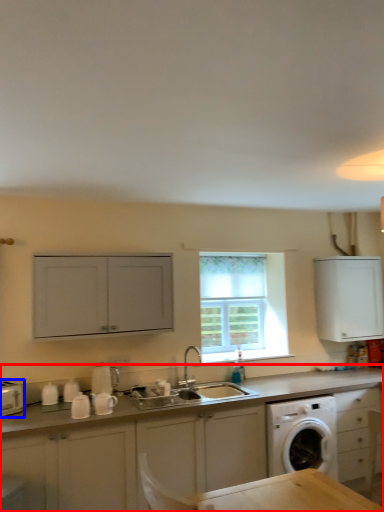
Question: Which point is further to the camera, cabinetry (highlighted by a red box) or appliance (highlighted by a blue box)?

Choices:
 (A) cabinetry
 (B) appliance

Answer: (B)